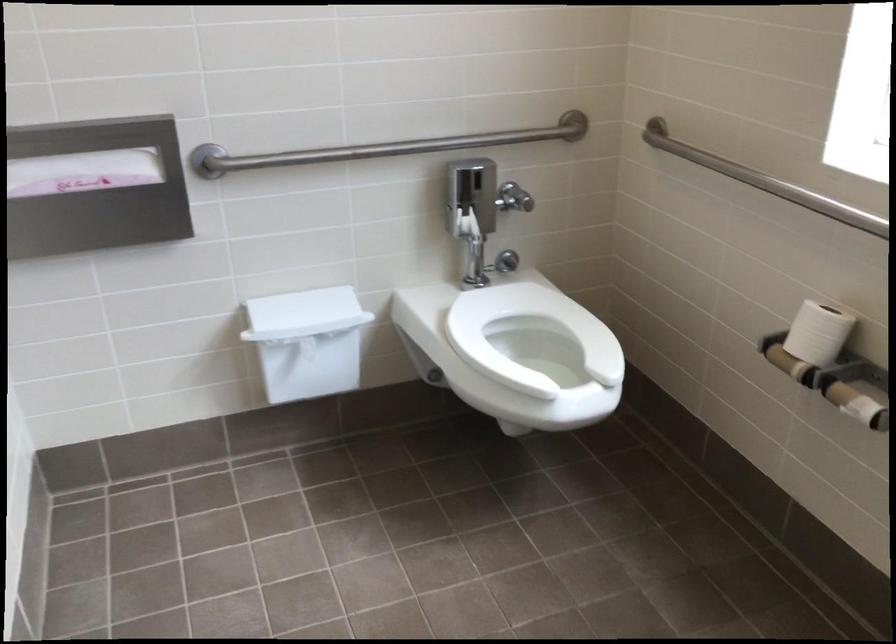
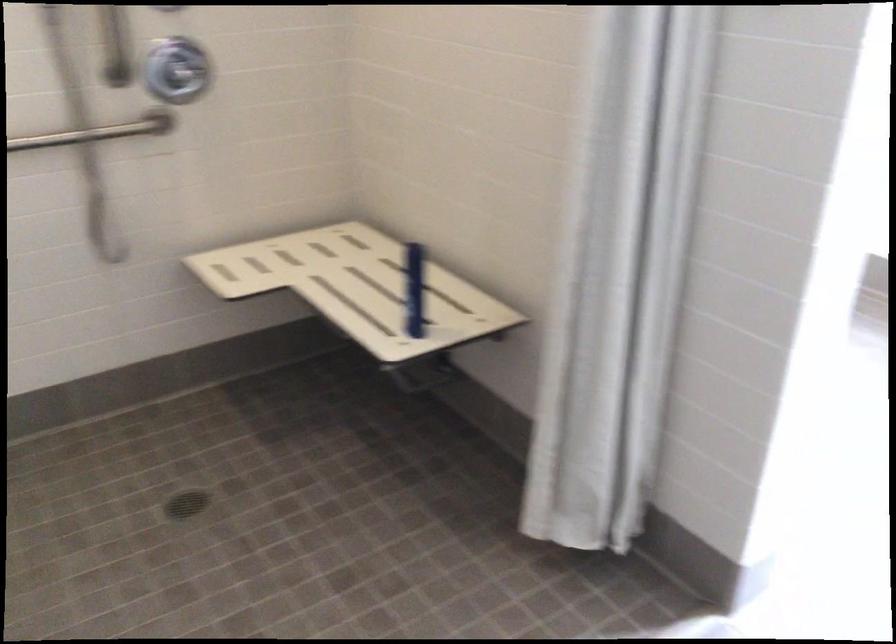
Question: I am providing you with two images of the same scene from different viewpoints. Which of the following objects are not visible in image2?

Choices:
 (A) metal grab bar
 (B) green plastic tray
 (C) chair sitting surface
 (D) chrome shower dial

Answer: (A)